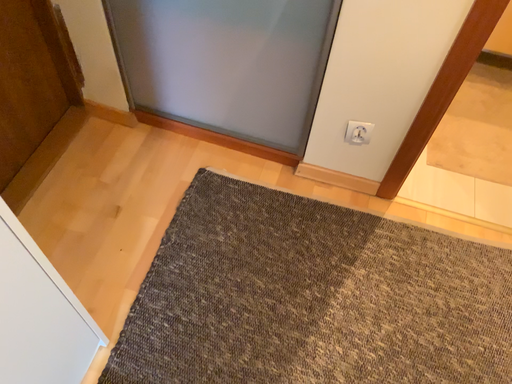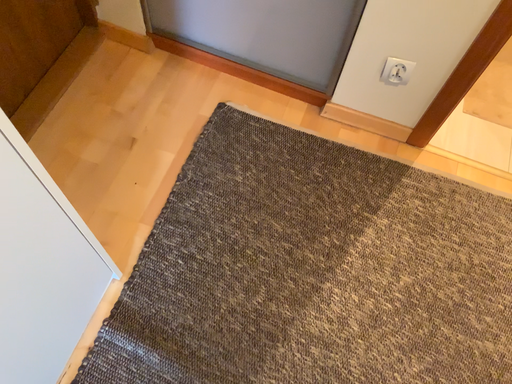
Question: How did the camera likely rotate when shooting the video?

Choices:
 (A) rotated upward
 (B) rotated downward

Answer: (B)